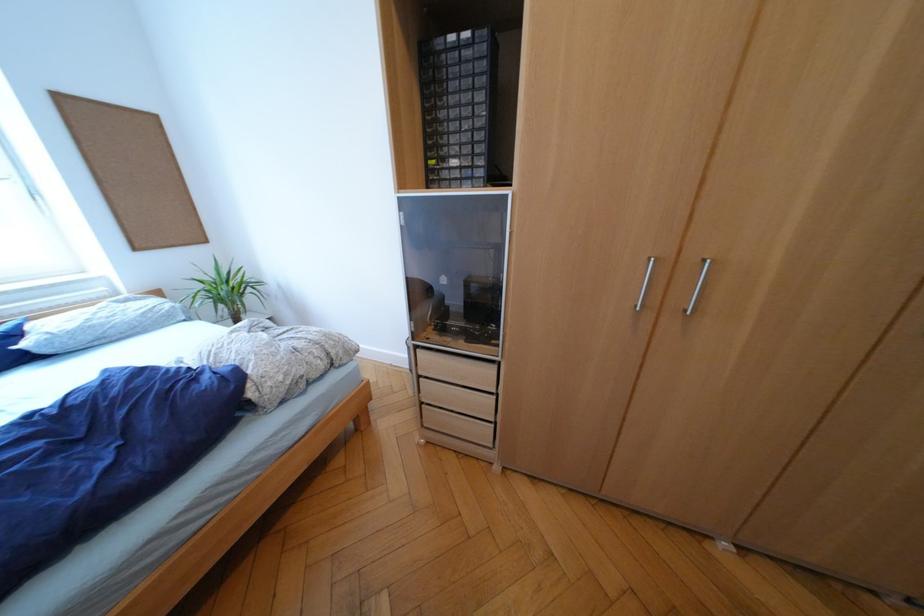
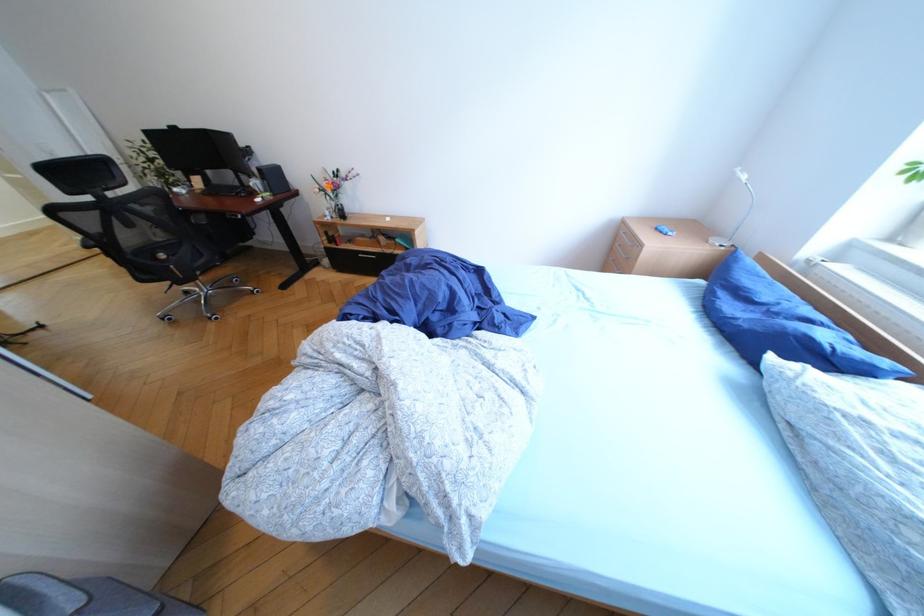
Find the pixel in the second image that matches (112,315) in the first image.

(912, 448)